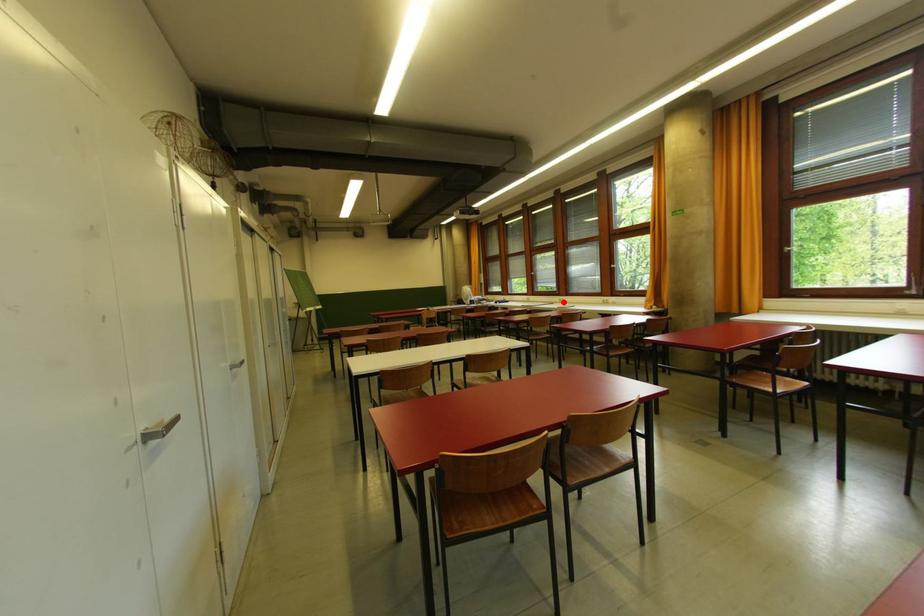
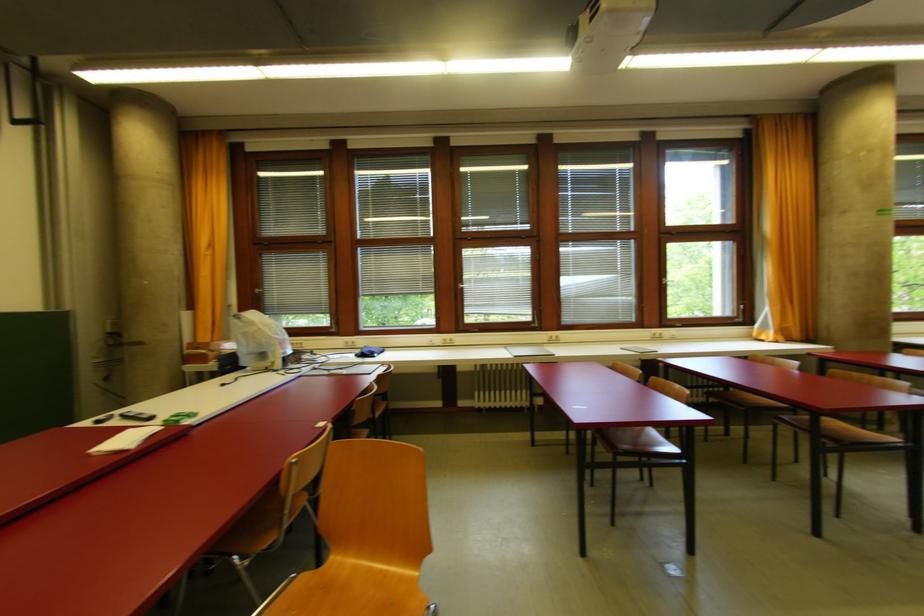
In the second image, find the point that corresponds to the highlighted location in the first image.

(556, 339)